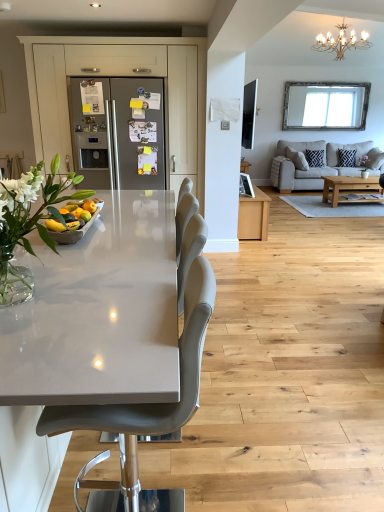
Locate an element on the screen. This screenshot has width=384, height=512. navy blue textured cushion at center right, the 1th pillow positioned from the right is located at coordinates (346, 157).

Find the location of `beige fabric couch at right`. beige fabric couch at right is located at coordinates (318, 166).

This screenshot has width=384, height=512. Find the location of `oak wood coffee table at center`. oak wood coffee table at center is located at coordinates (352, 190).

Find the location of `clear glass vase at center`. clear glass vase at center is located at coordinates (28, 224).

This screenshot has height=512, width=384. In order to click on navy blue textured cushion at center right, the 2th pillow from the left in this screenshot , I will do `click(346, 157)`.

In the scene shown: Is satin silver refrigerator at center smaller than black woven pillow at upper right, which appears as the 2th pillow when viewed from the right?

No, satin silver refrigerator at center is not smaller than black woven pillow at upper right, which appears as the 2th pillow when viewed from the right.

Can you confirm if satin silver refrigerator at center is wider than black woven pillow at upper right, which appears as the 2th pillow when viewed from the right?

Indeed, satin silver refrigerator at center has a greater width compared to black woven pillow at upper right, which appears as the 2th pillow when viewed from the right.

Is satin silver refrigerator at center spatially inside black woven pillow at upper right, which appears as the 2th pillow when viewed from the right, or outside of it?

satin silver refrigerator at center is spatially situated outside black woven pillow at upper right, which appears as the 2th pillow when viewed from the right.

Which is closer, (x=137, y=466) or (x=313, y=161)?

Clearly, point (x=137, y=466) is closer to the camera than point (x=313, y=161).

Considering the relative positions of matte gray chair at center and black woven pillow at upper right, which is counted as the 1th pillow, starting from the left, in the image provided, is matte gray chair at center in front of black woven pillow at upper right, which is counted as the 1th pillow, starting from the left,?

Yes, matte gray chair at center is closer to the camera.

From a real-world perspective, is matte gray chair at center above or below black woven pillow at upper right, which appears as the 2th pillow when viewed from the right?

Clearly, from a real-world perspective, matte gray chair at center is below black woven pillow at upper right, which appears as the 2th pillow when viewed from the right.

In the image, is glossy white countertop at center positioned in front of or behind satin silver refrigerator at center?

In the image, glossy white countertop at center appears in front of satin silver refrigerator at center.

Which is in front, point (85, 255) or point (122, 138)?

The point (85, 255) is more forward.

From the image's perspective, is glossy white countertop at center under satin silver refrigerator at center?

Correct, glossy white countertop at center appears lower than satin silver refrigerator at center in the image.

From a real-world perspective, is glossy white countertop at center positioned under satin silver refrigerator at center based on gravity?

Correct, in the physical world, glossy white countertop at center is lower than satin silver refrigerator at center.

Where is `the 1st pillow above when counting from the beige fabric couch at right (from the image's perspective)`? the 1st pillow above when counting from the beige fabric couch at right (from the image's perspective) is located at coordinates (315, 157).

Is black woven pillow at upper right, which appears as the 2th pillow when viewed from the right, in front of or behind beige fabric couch at right in the image?

Visually, black woven pillow at upper right, which appears as the 2th pillow when viewed from the right, is located behind beige fabric couch at right.

Is black woven pillow at upper right, which appears as the 2th pillow when viewed from the right, looking in the opposite direction of beige fabric couch at right?

Yes, black woven pillow at upper right, which appears as the 2th pillow when viewed from the right, is facing away from beige fabric couch at right.

Is black woven pillow at upper right, which appears as the 2th pillow when viewed from the right, at the right side of beige fabric couch at right?

No.

Where is `floral arrangement above the glossy white countertop at center (from a real-world perspective)`? floral arrangement above the glossy white countertop at center (from a real-world perspective) is located at coordinates (28, 224).

Considering the sizes of clear glass vase at center and glossy white countertop at center in the image, is clear glass vase at center bigger or smaller than glossy white countertop at center?

clear glass vase at center is smaller than glossy white countertop at center.

Is clear glass vase at center aimed at glossy white countertop at center?

No, clear glass vase at center is not turned towards glossy white countertop at center.

From a real-world perspective, is clear glass vase at center positioned above or below glossy white countertop at center?

From a real-world perspective, clear glass vase at center is physically above glossy white countertop at center.

How different are the orientations of black woven pillow at upper right, which appears as the 2th pillow when viewed from the right, and clear glass vase at center in degrees?

They differ by 82.3 degrees in their facing directions.

From their relative heights in the image, would you say black woven pillow at upper right, which appears as the 2th pillow when viewed from the right, is taller or shorter than clear glass vase at center?

In the image, black woven pillow at upper right, which appears as the 2th pillow when viewed from the right, appears to be taller than clear glass vase at center.

Is point (312, 152) farther from camera compared to point (7, 204)?

Yes, it is behind point (7, 204).

Is black woven pillow at upper right, which is counted as the 1th pillow, starting from the left, outside of clear glass vase at center?

Yes, black woven pillow at upper right, which is counted as the 1th pillow, starting from the left, is outside of clear glass vase at center.

From the picture: From the image's perspective, is oak wood coffee table at center positioned above or below gold metallic chandelier at upper right?

oak wood coffee table at center is situated lower than gold metallic chandelier at upper right in the image.

Considering their positions, is oak wood coffee table at center located in front of or behind gold metallic chandelier at upper right?

Visually, oak wood coffee table at center is located behind gold metallic chandelier at upper right.

The image size is (384, 512). What are the coordinates of `light fixture above the oak wood coffee table at center (from the image's perspective)` in the screenshot? It's located at (341, 42).

Where is `the 1st pillow behind when counting from the satin silver refrigerator at center`? the 1st pillow behind when counting from the satin silver refrigerator at center is located at coordinates (315, 157).

Identify the location of the 1st pillow above the matte gray chair at center (from the image's perspective). Image resolution: width=384 pixels, height=512 pixels. (315, 157).

Looking at the image, which one is located further to satin silver refrigerator at center, clear glass vase at center or navy blue textured cushion at center right, the 1th pillow positioned from the right?

navy blue textured cushion at center right, the 1th pillow positioned from the right, lies further to satin silver refrigerator at center than the other object.

Looking at the image, which one is located further to satin silver refrigerator at center, matte gray chair at center or navy blue textured cushion at center right, the 1th pillow positioned from the right?

Based on the image, navy blue textured cushion at center right, the 1th pillow positioned from the right, appears to be further to satin silver refrigerator at center.

When comparing their distances from navy blue textured cushion at center right, the 1th pillow positioned from the right, does beige fabric couch at right or oak wood coffee table at center seem further?

oak wood coffee table at center lies further to navy blue textured cushion at center right, the 1th pillow positioned from the right, than the other object.

Which object lies nearer to the anchor point glossy white countertop at center, gold metallic chandelier at upper right or navy blue textured cushion at center right, the 2th pillow from the left?

gold metallic chandelier at upper right is closer to glossy white countertop at center.

Looking at the image, which one is located further to oak wood coffee table at center, navy blue textured cushion at center right, the 1th pillow positioned from the right, or satin silver refrigerator at center?

The object further to oak wood coffee table at center is satin silver refrigerator at center.

Estimate the real-world distances between objects in this image. Which object is further from navy blue textured cushion at center right, the 2th pillow from the left, oak wood coffee table at center or clear glass vase at center?

clear glass vase at center is positioned further to the anchor navy blue textured cushion at center right, the 2th pillow from the left.

When comparing their distances from navy blue textured cushion at center right, the 2th pillow from the left, does gold metallic chandelier at upper right or clear glass vase at center seem further?

clear glass vase at center lies further to navy blue textured cushion at center right, the 2th pillow from the left, than the other object.

Looking at the image, which one is located further to satin silver refrigerator at center, oak wood coffee table at center or navy blue textured cushion at center right, the 1th pillow positioned from the right?

navy blue textured cushion at center right, the 1th pillow positioned from the right, lies further to satin silver refrigerator at center than the other object.

At what (x,y) coordinates should I click in order to perform the action: click on chair between clear glass vase at center and navy blue textured cushion at center right, the 1th pillow positioned from the right, in the front-back direction. Please return your answer as a coordinate pair (x, y). This screenshot has width=384, height=512. Looking at the image, I should click on (146, 404).

Where is `pillow located between matte gray chair at center and navy blue textured cushion at center right, the 2th pillow from the left, in the depth direction`? The image size is (384, 512). pillow located between matte gray chair at center and navy blue textured cushion at center right, the 2th pillow from the left, in the depth direction is located at coordinates (315, 157).

You are a GUI agent. You are given a task and a screenshot of the screen. Output one action in this format:
    pyautogui.click(x=<x>, y=<y>)
    Task: Click on the chair between clear glass vase at center and black woven pillow at upper right, which appears as the 2th pillow when viewed from the right, in the front-back direction
    This screenshot has height=512, width=384.
    Given the screenshot: What is the action you would take?
    pyautogui.click(x=146, y=404)

Where is `coffee table between matte gray chair at center and beige fabric couch at right from front to back`? This screenshot has width=384, height=512. coffee table between matte gray chair at center and beige fabric couch at right from front to back is located at coordinates (352, 190).